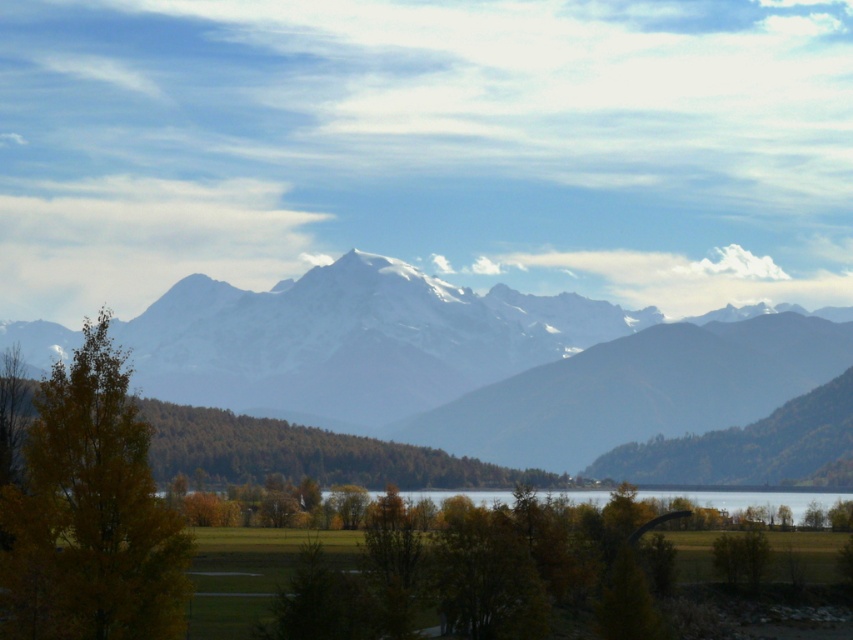
Question: Which object appears farthest from the camera in this image?

Choices:
 (A) yellow-green foliage at left
 (B) white snow-covered mountain range at center

Answer: (B)

Question: Which point appears closest to the camera in this image?

Choices:
 (A) (152, 508)
 (B) (827, 493)
 (C) (537, 362)
 (D) (202, 449)

Answer: (A)

Question: Is yellow-green foliage at left to the left of transparent water at center from the viewer's perspective?

Choices:
 (A) no
 (B) yes

Answer: (B)

Question: Does white snow-covered mountain range at center appear on the right side of yellow-green foliage at left?

Choices:
 (A) yes
 (B) no

Answer: (A)

Question: Does white snow-covered mountain range at center have a larger size compared to transparent water at center?

Choices:
 (A) yes
 (B) no

Answer: (A)

Question: Which of the following is the farthest from the observer?

Choices:
 (A) transparent water at center
 (B) yellow-green foliage at left

Answer: (A)